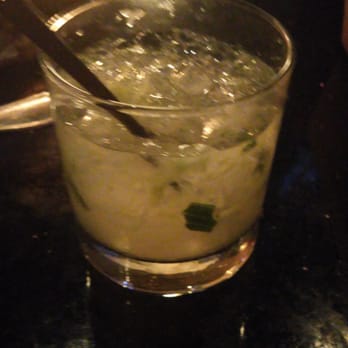
The image size is (348, 348). I want to click on black counter, so click(124, 304).